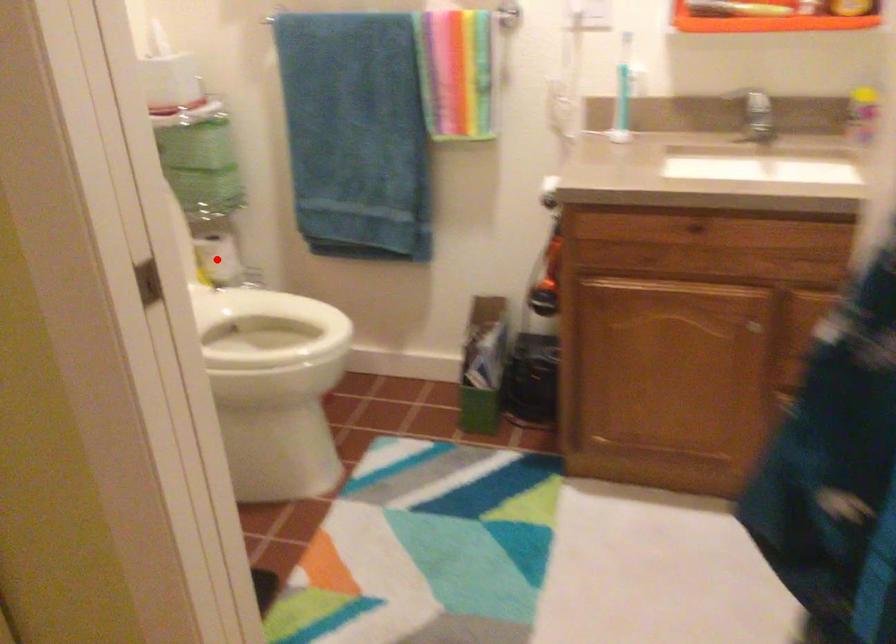
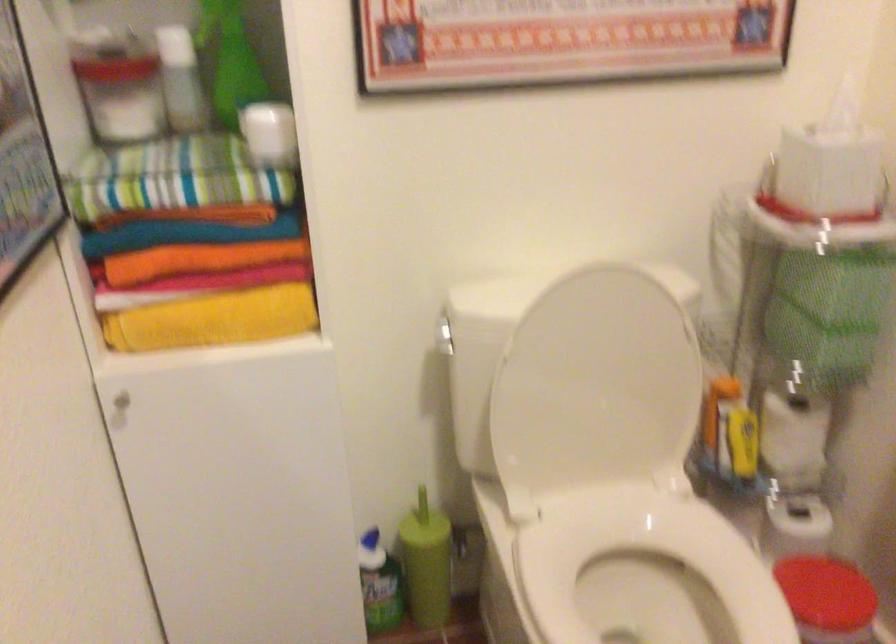
Question: I am providing you with two images of the same scene from different viewpoints. Image1 has a red point marked. In image2, the corresponding 3D location appears at what relative position? Reply with the corresponding letter.

Choices:
 (A) Closer
 (B) Farther

Answer: (A)